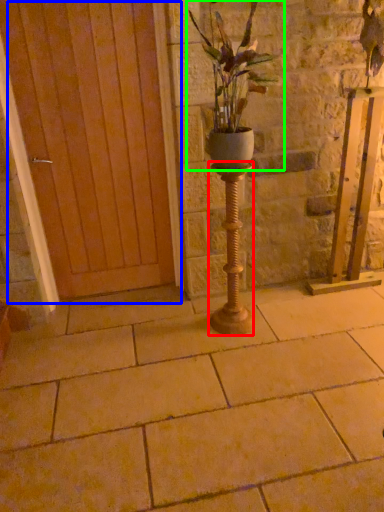
Question: Which object is positioned farthest from candle holder (highlighted by a red box)? Select from door (highlighted by a blue box) and houseplant (highlighted by a green box).

Choices:
 (A) door
 (B) houseplant

Answer: (A)